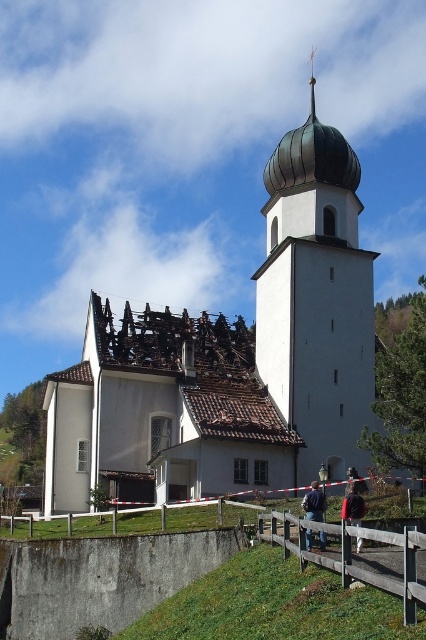
You are standing at the point marked as point (353, 557) in the damaged church scene. What material are you currently standing on?

The point (353, 557) is on wooden at lower center, so you are standing on wooden material.

You are a firefighter assessing the damage to the church. You notice the green copper dome at center and the denim jacket at center. Which object is higher in elevation?

The green copper dome at center is taller than the denim jacket at center, so the green copper dome at center is higher in elevation.